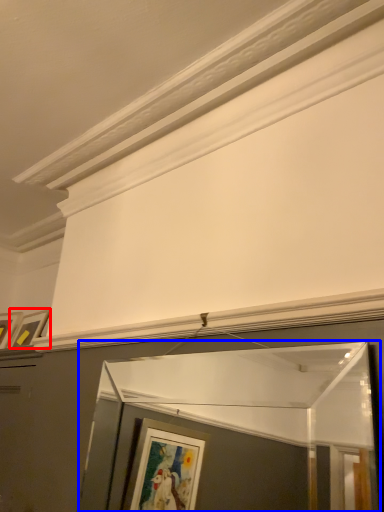
Question: Which object appears closest to the camera in this image, picture frame (highlighted by a red box) or window frame (highlighted by a blue box)?

Choices:
 (A) picture frame
 (B) window frame

Answer: (B)